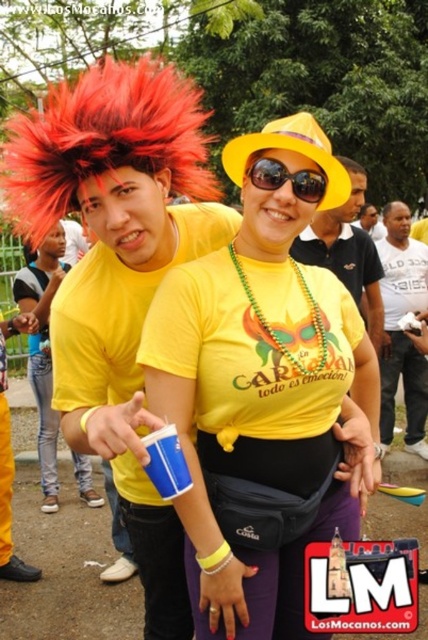
You are organizing a costume party and need to decide which shirt to wear. Both the white cotton shirt at center and the matte yellow shirt at center are options. Based on their descriptions, which shirt would be more comfortable for a day of dancing and movement?

The white cotton shirt at center is thinner than the matte yellow shirt at center, so it would likely be more comfortable for dancing and movement due to its lighter weight.

You are a photographer at the event and want to capture a shot where the yellow matte cup at center is clearly visible above the matte yellow shirt at center. Based on the scene description, will the cup be visible above the shirt in this composition?

The yellow matte cup at center has a greater height compared to the matte yellow shirt at center, so yes, the cup will be visible above the shirt in the composition.

You are organizing a photo shoot and need to ensure that all items in the center of the image are visible. Given that the white cotton shirt at center and the sunglasses at center are both in the center, which item will likely require more space in the frame to be fully captured?

The white cotton shirt at center is larger in size than the sunglasses at center, so it will require more space in the frame to be fully captured.